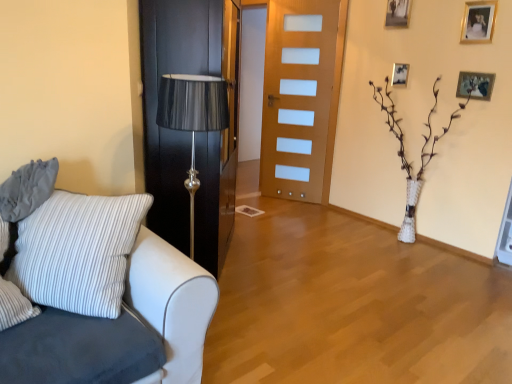
Question: Is point (109, 223) positioned closer to the camera than point (11, 205)?

Choices:
 (A) closer
 (B) farther

Answer: (A)

Question: From a real-world perspective, is white fabric couch at left above or below gray fabric pillow at left?

Choices:
 (A) above
 (B) below

Answer: (B)

Question: Considering the real-world distances, which object is farthest from the wooden picture frame at upper right, the 1th picture frame from the top?

Choices:
 (A) black wood door at center, the 1th door when ordered from left to right
 (B) gold metallic picture frame at upper right, the second picture frame from the right
 (C) wooden picture frame at upper right, the 4th picture frame positioned from the top
 (D) gray fabric pillow at left
 (E) white fabric couch at left

Answer: (E)

Question: Which object is the farthest from the wooden door at center, which is counted as the second door, starting from the left?

Choices:
 (A) wooden picture frame at upper right, positioned as the second picture frame in left-to-right order
 (B) wooden picture frame at upper right, the 4th picture frame positioned from the left
 (C) white fabric couch at left
 (D) wooden picture frame at upper right, arranged as the 1th picture frame when viewed from the left
 (E) black wood door at center, the 1th door when ordered from left to right

Answer: (C)